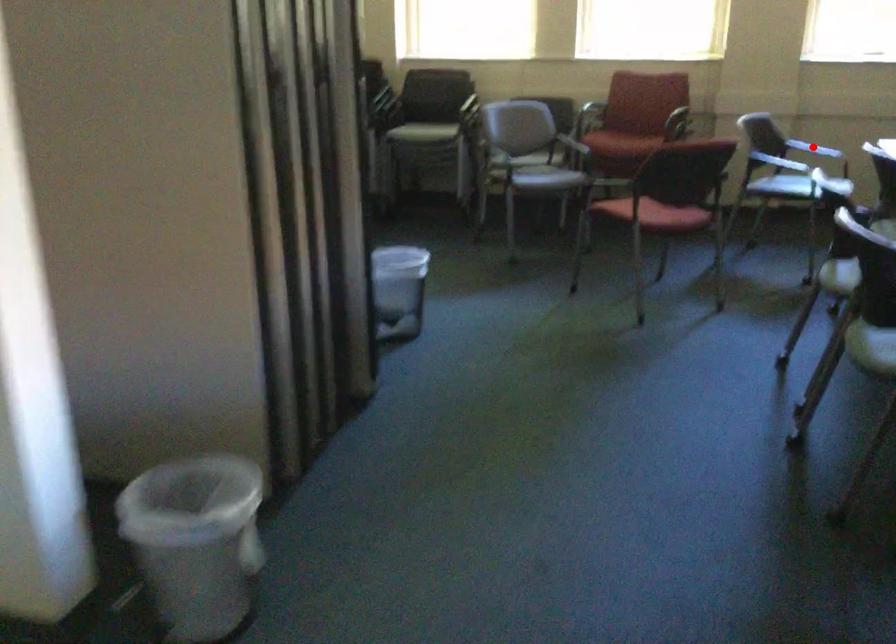
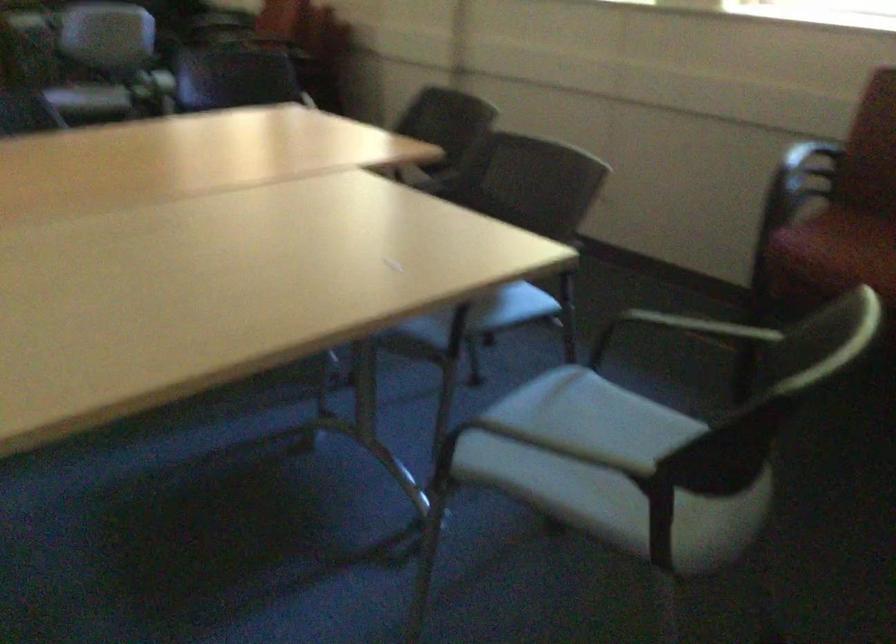
Question: I am providing you with two images of the same scene from different viewpoints. A red point is marked on the first image. At the location where the point appears in image 1, is it still visible in image 2?

Choices:
 (A) Yes
 (B) No

Answer: (B)